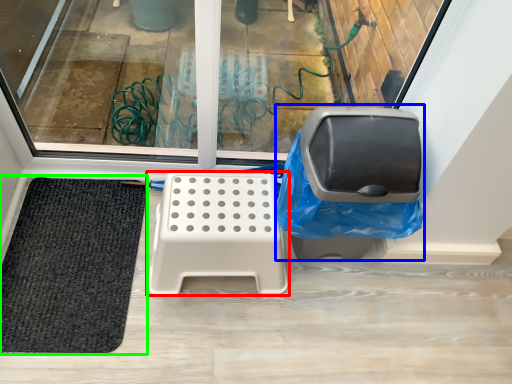
Question: Based on their relative distances, which object is farther from furniture (highlighted by a red box)? Choose from swivel chair (highlighted by a blue box) and mat (highlighted by a green box).

Choices:
 (A) swivel chair
 (B) mat

Answer: (B)